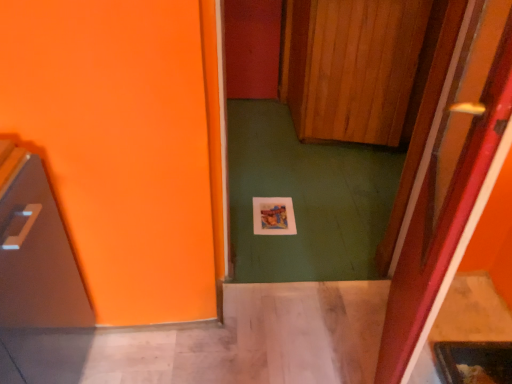
Question: Should I look upward or downward to see shiny metallic microwave at left?

Choices:
 (A) up
 (B) down

Answer: (B)

Question: Is wooden at center, placed as the second door when sorted from front to back, in contact with shiny metallic microwave at left?

Choices:
 (A) yes
 (B) no

Answer: (B)

Question: Is wooden at center, the first door viewed from the top, closer to camera compared to shiny metallic microwave at left?

Choices:
 (A) no
 (B) yes

Answer: (A)

Question: From the image's perspective, would you say wooden at center, the 1th door from the back, is positioned over shiny metallic microwave at left?

Choices:
 (A) no
 (B) yes

Answer: (B)

Question: Is shiny metallic microwave at left surrounded by wooden at center, the 1th door from the back?

Choices:
 (A) no
 (B) yes

Answer: (A)

Question: Considering the relative sizes of wooden at center, the 2th door positioned from the bottom, and shiny metallic microwave at left in the image provided, is wooden at center, the 2th door positioned from the bottom, wider than shiny metallic microwave at left?

Choices:
 (A) yes
 (B) no

Answer: (A)

Question: Does wooden at center, placed as the second door when sorted from front to back, have a lesser height compared to shiny metallic microwave at left?

Choices:
 (A) yes
 (B) no

Answer: (B)

Question: Is wooden at center, the second door in the top-to-bottom sequence, with shiny metallic microwave at left?

Choices:
 (A) no
 (B) yes

Answer: (A)

Question: Is wooden at center, the second door when ordered from back to front, bigger than shiny metallic microwave at left?

Choices:
 (A) no
 (B) yes

Answer: (A)

Question: From the image's perspective, would you say wooden at center, which is counted as the 1th door, starting from the front, is positioned over shiny metallic microwave at left?

Choices:
 (A) no
 (B) yes

Answer: (B)

Question: Can you confirm if wooden at center, the second door in the top-to-bottom sequence, is positioned to the right of shiny metallic microwave at left?

Choices:
 (A) yes
 (B) no

Answer: (A)

Question: Is wooden at center, the second door in the top-to-bottom sequence, aimed at shiny metallic microwave at left?

Choices:
 (A) no
 (B) yes

Answer: (B)

Question: Is shiny metallic microwave at left surrounded by wooden at center, the second door in the top-to-bottom sequence?

Choices:
 (A) yes
 (B) no

Answer: (B)

Question: Can you confirm if wooden at center, placed as the second door when sorted from front to back, is shorter than wooden at center, the second door in the top-to-bottom sequence?

Choices:
 (A) no
 (B) yes

Answer: (B)